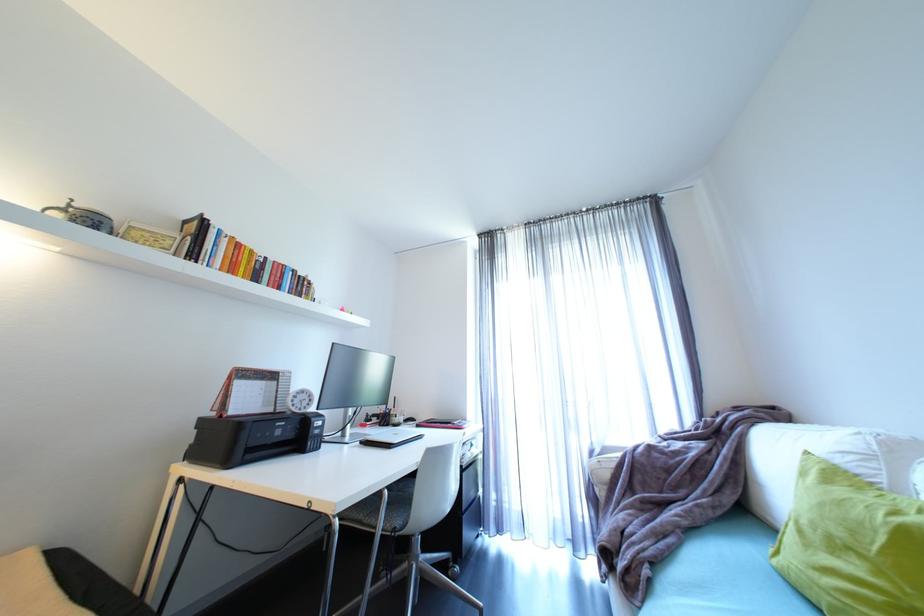
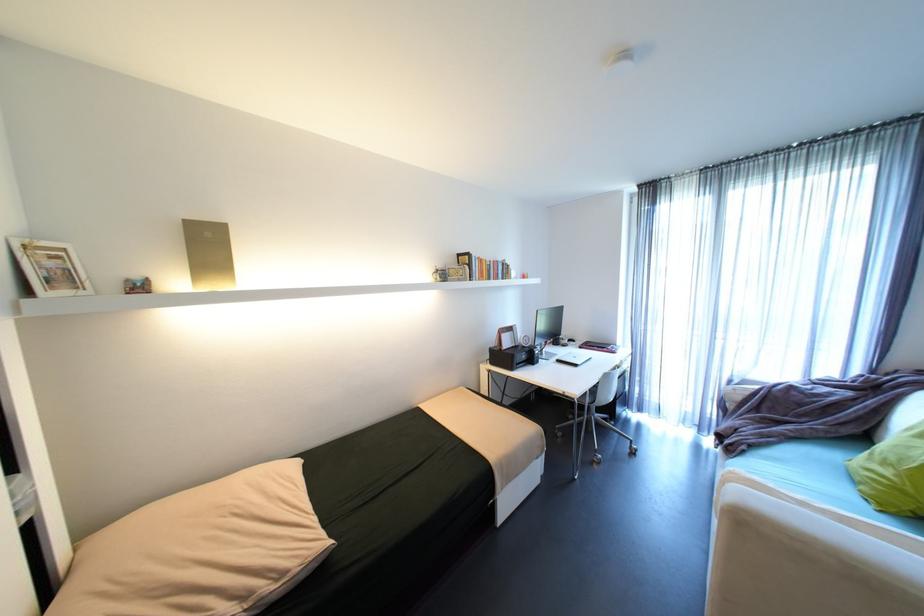
Where in the second image is the point corresponding to point 282,262 from the first image?

(500, 262)